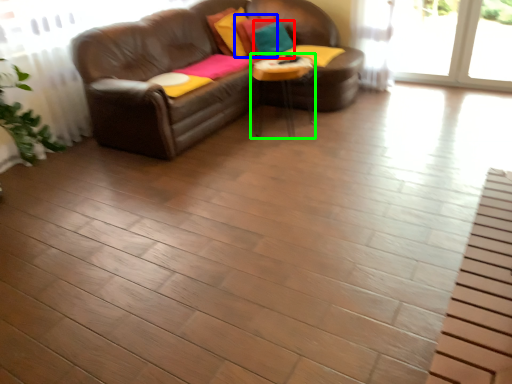
Question: Based on their relative distances, which object is farther from pillow (highlighted by a red box)? Choose from pillow (highlighted by a blue box) and table (highlighted by a green box).

Choices:
 (A) pillow
 (B) table

Answer: (B)